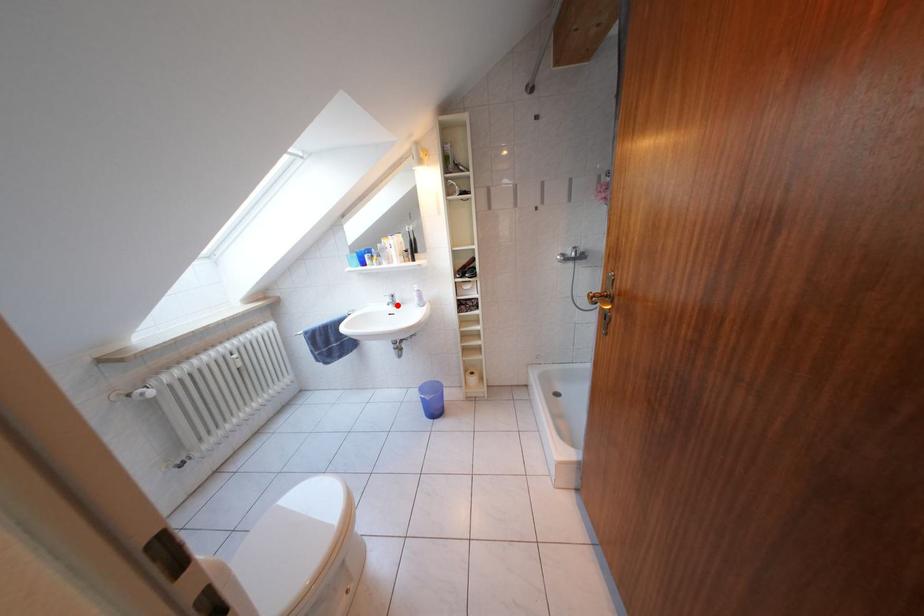
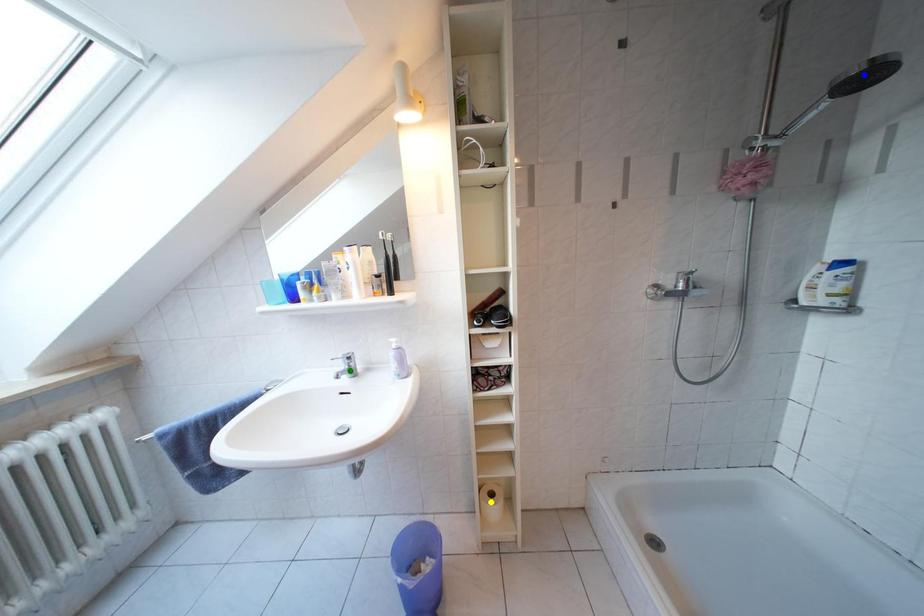
Question: I am providing you with two images of the same scene from different viewpoints. A red point is marked on the first image. You are given multiple points on the second image. Which point in image 2 represents the same 3d spot as the red point in image 1?

Choices:
 (A) yellow point
 (B) blue point
 (C) green point

Answer: (C)